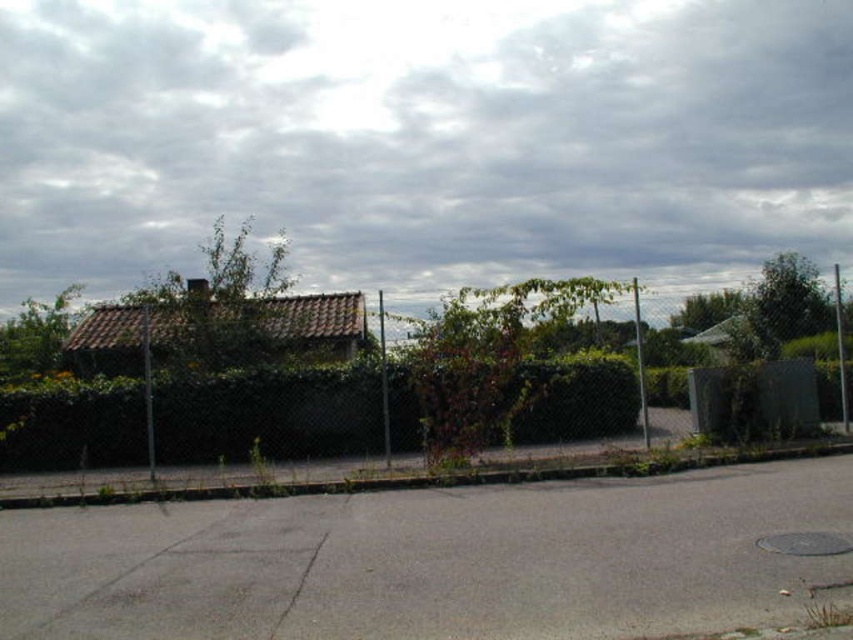
Which is more to the left, cloudy sky at upper center or green leafy hedge at center?

Positioned to the left is green leafy hedge at center.

Can you confirm if cloudy sky at upper center is taller than green leafy hedge at center?

Correct, cloudy sky at upper center is much taller as green leafy hedge at center.

In order to click on cloudy sky at upper center in this screenshot , I will do pos(424,138).

Does cloudy sky at upper center appear over metallic chain-link fence at center?

Yes.

Does point (802, 28) come closer to viewer compared to point (339, 376)?

No, (802, 28) is further to viewer.

Is point (16, 148) in front of point (274, 448)?

No, (16, 148) is further to viewer.

This screenshot has width=853, height=640. I want to click on cloudy sky at upper center, so click(x=424, y=138).

Can you confirm if metallic chain-link fence at center is smaller than green leafy hedge at center?

No.

Is metallic chain-link fence at center bigger than green leafy hedge at center?

Correct, metallic chain-link fence at center is larger in size than green leafy hedge at center.

Is point (418, 445) closer to camera compared to point (560, 426)?

That is True.

Where is `metallic chain-link fence at center`? The height and width of the screenshot is (640, 853). metallic chain-link fence at center is located at coordinates (270, 413).